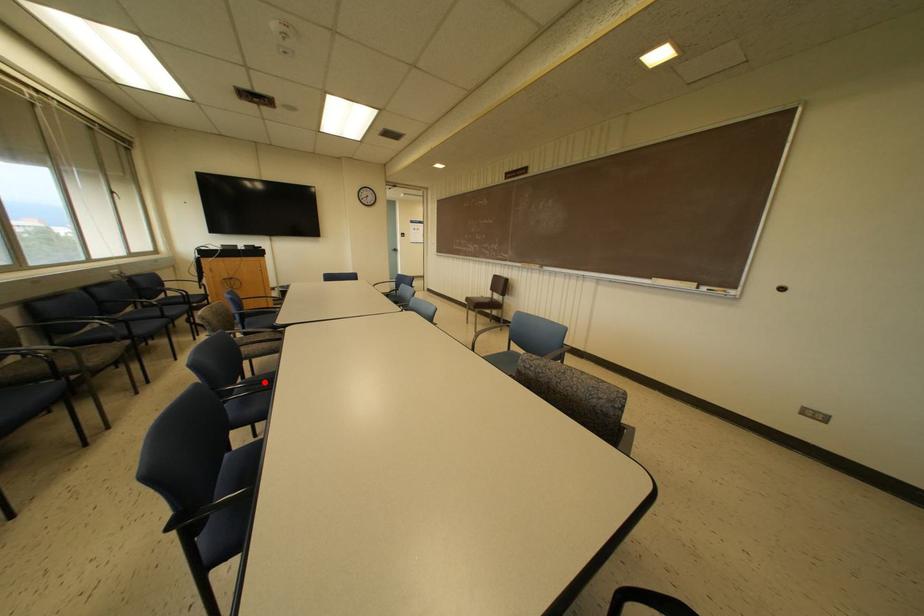
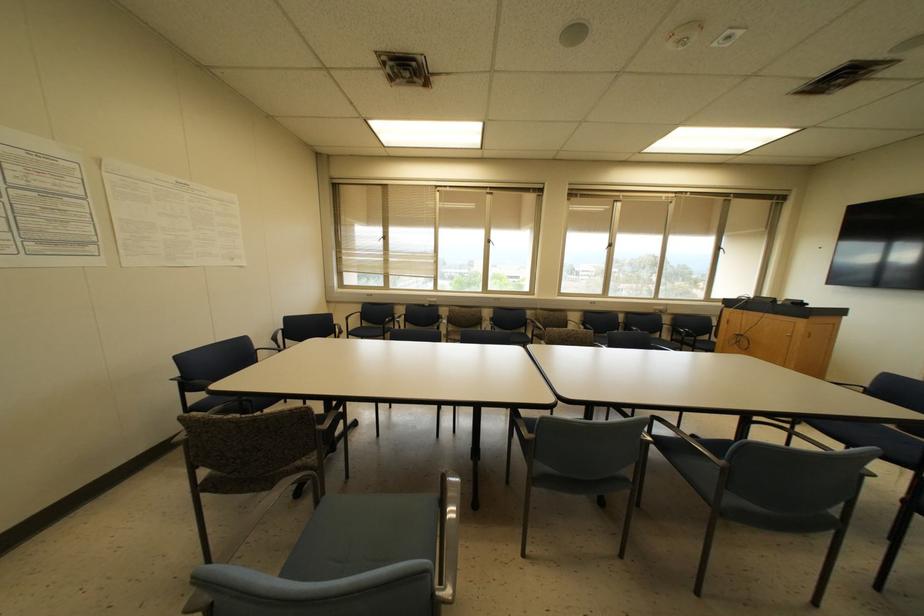
Question: I am providing you with two images of the same scene from different viewpoints. A red point is marked on the first image. At the location where the point appears in image 1, is it still visible in image 2?

Choices:
 (A) Yes
 (B) No

Answer: (B)